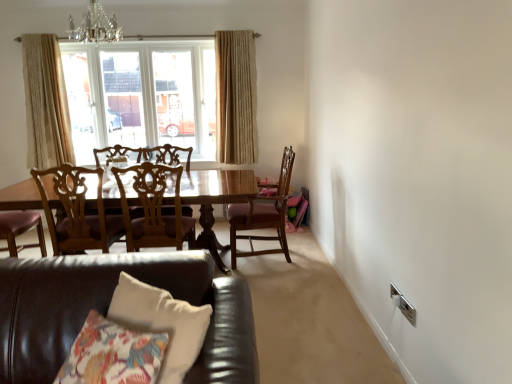
Question: Considering the relative sizes of wooden chair with carved backrest at center, the first chair from the left, and crystal glass chandelier at upper center in the image provided, is wooden chair with carved backrest at center, the first chair from the left, shorter than crystal glass chandelier at upper center?

Choices:
 (A) no
 (B) yes

Answer: (A)

Question: Considering the relative positions of wooden chair with carved backrest at center, which appears as the third chair when viewed from the right, and crystal glass chandelier at upper center in the image provided, is wooden chair with carved backrest at center, which appears as the third chair when viewed from the right, to the right of crystal glass chandelier at upper center from the viewer's perspective?

Choices:
 (A) yes
 (B) no

Answer: (B)

Question: Could crystal glass chandelier at upper center be considered to be inside wooden chair with carved backrest at center, which appears as the third chair when viewed from the right?

Choices:
 (A) no
 (B) yes

Answer: (A)

Question: From a real-world perspective, is wooden chair with carved backrest at center, the first chair from the left, on crystal glass chandelier at upper center?

Choices:
 (A) yes
 (B) no

Answer: (B)

Question: Can you confirm if wooden chair with carved backrest at center, the first chair from the left, is thinner than crystal glass chandelier at upper center?

Choices:
 (A) yes
 (B) no

Answer: (B)

Question: Choose the correct answer: Is crystal glass chandelier at upper center inside wooden chair at center, the 2th chair when ordered from right to left, or outside it?

Choices:
 (A) inside
 (B) outside

Answer: (B)

Question: From the image's perspective, relative to wooden chair at center, the 2th chair when ordered from right to left, is crystal glass chandelier at upper center above or below?

Choices:
 (A) below
 (B) above

Answer: (B)

Question: Considering their positions, is crystal glass chandelier at upper center located in front of or behind wooden chair at center, positioned as the 2th chair in left-to-right order?

Choices:
 (A) behind
 (B) front

Answer: (A)

Question: Considering the relative positions of crystal glass chandelier at upper center and wooden chair at center, the 2th chair when ordered from right to left, in the image provided, is crystal glass chandelier at upper center to the left or to the right of wooden chair at center, the 2th chair when ordered from right to left,?

Choices:
 (A) left
 (B) right

Answer: (A)

Question: Based on their positions, is leather couch at lower left located to the left or right of wooden chair with carved backrest at center, the first chair from the left?

Choices:
 (A) right
 (B) left

Answer: (A)

Question: From their relative heights in the image, would you say leather couch at lower left is taller or shorter than wooden chair with carved backrest at center, which appears as the third chair when viewed from the right?

Choices:
 (A) short
 (B) tall

Answer: (A)

Question: From the image's perspective, is leather couch at lower left positioned above or below wooden chair with carved backrest at center, which appears as the third chair when viewed from the right?

Choices:
 (A) above
 (B) below

Answer: (B)

Question: Relative to wooden chair with carved backrest at center, the first chair from the left, is leather couch at lower left in front or behind?

Choices:
 (A) front
 (B) behind

Answer: (A)

Question: From a real-world perspective, is beige textured curtain at left, arranged as the 1th curtain when viewed from the left, above or below leather couch at lower left?

Choices:
 (A) above
 (B) below

Answer: (A)

Question: Relative to leather couch at lower left, is beige textured curtain at left, arranged as the 1th curtain when viewed from the left, in front or behind?

Choices:
 (A) behind
 (B) front

Answer: (A)